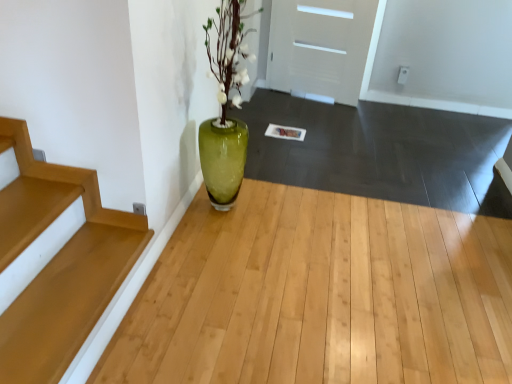
Where is `vacant space situated above wooden stairs at lower left (from a real-world perspective)`? This screenshot has width=512, height=384. vacant space situated above wooden stairs at lower left (from a real-world perspective) is located at coordinates (69, 289).